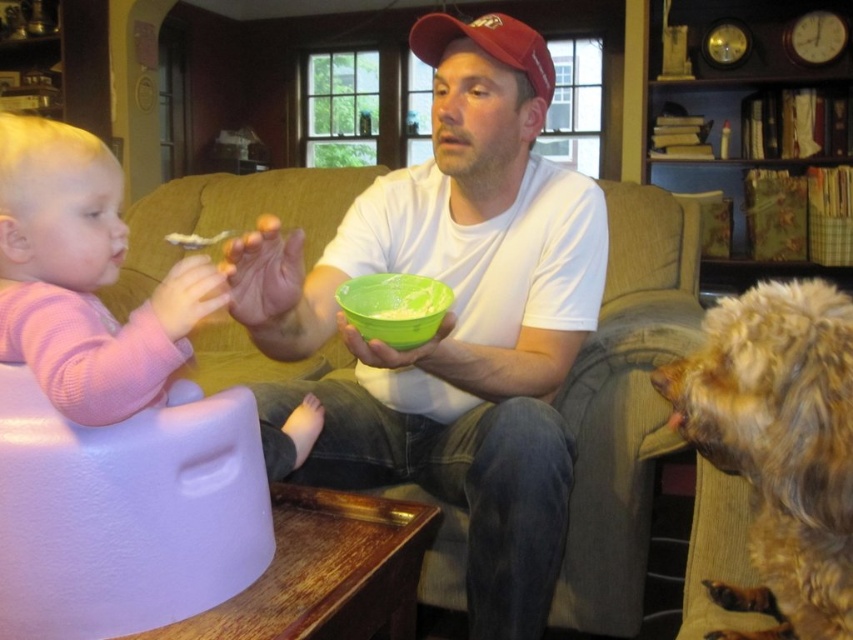
Question: Where is white matte shirt at center located in relation to maroon fabric baseball cap at upper center in the image?

Choices:
 (A) above
 (B) below

Answer: (B)

Question: Which object appears closest to the camera in this image?

Choices:
 (A) pink soft fabric baby at left
 (B) green matte bowl at center
 (C) white matte cracker at upper left
 (D) white matte shirt at center

Answer: (A)

Question: Which point is farther to the camera?

Choices:
 (A) white matte cracker at upper left
 (B) pink soft fabric baby at left

Answer: (A)

Question: Can you confirm if fuzzy brown fur at lower right is thinner than pink soft fabric baby at left?

Choices:
 (A) no
 (B) yes

Answer: (B)

Question: Does pink soft fabric baby at left have a smaller size compared to green plastic bowl at center?

Choices:
 (A) no
 (B) yes

Answer: (A)

Question: Which object appears farthest from the camera in this image?

Choices:
 (A) white matte shirt at center
 (B) fuzzy brown fur at lower right

Answer: (A)